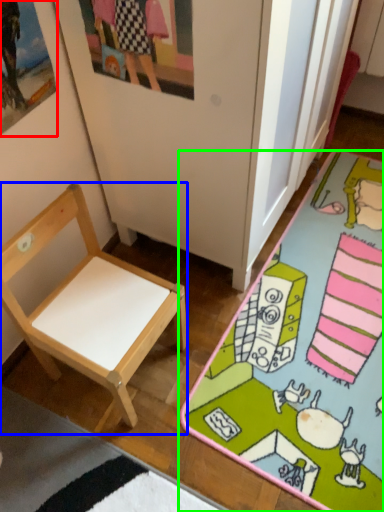
Question: Which object is the farthest from picture frame (highlighted by a red box)? Choose among these: chair (highlighted by a blue box) or desk (highlighted by a green box).

Choices:
 (A) chair
 (B) desk

Answer: (B)